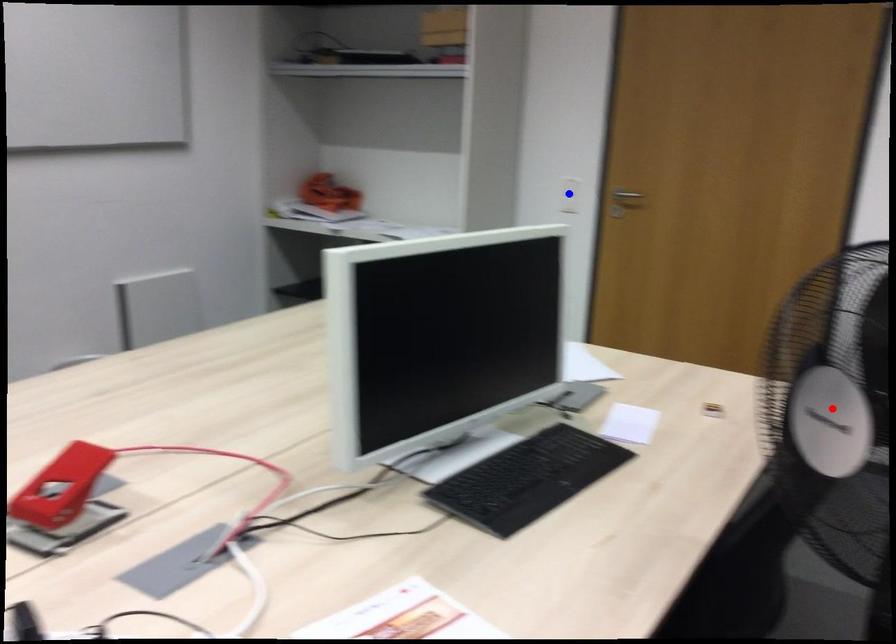
Question: In the image, two points are highlighted. Which point is nearer to the camera? Reply with the corresponding letter.

Choices:
 (A) blue point
 (B) red point

Answer: (B)